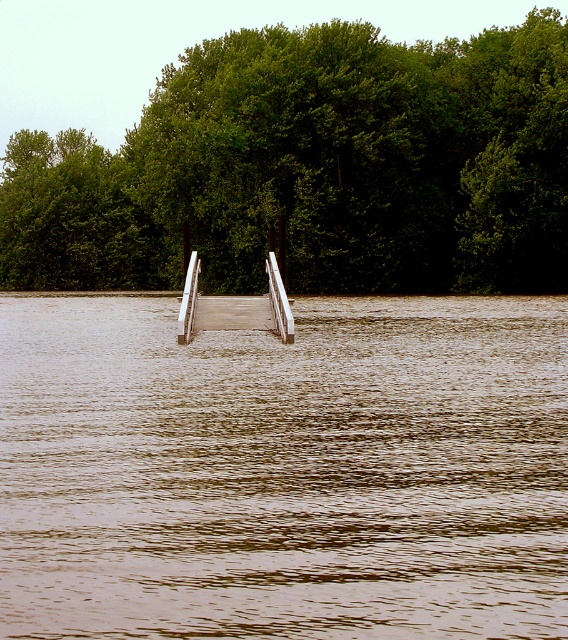
Question: Does brown muddy water at center appear on the right side of wooden dock at center?

Choices:
 (A) yes
 (B) no

Answer: (A)

Question: Which point is farther to the camera?

Choices:
 (A) (248, 307)
 (B) (502, 44)

Answer: (B)

Question: Which of the following is the farthest from the observer?

Choices:
 (A) brown muddy water at center
 (B) green leafy trees at center

Answer: (B)

Question: Is the position of green leafy trees at center more distant than that of wooden dock at center?

Choices:
 (A) yes
 (B) no

Answer: (A)

Question: Is green leafy trees at center positioned before wooden dock at center?

Choices:
 (A) yes
 (B) no

Answer: (B)

Question: Which object is closer to the camera taking this photo?

Choices:
 (A) green leafy trees at center
 (B) brown muddy water at center

Answer: (B)